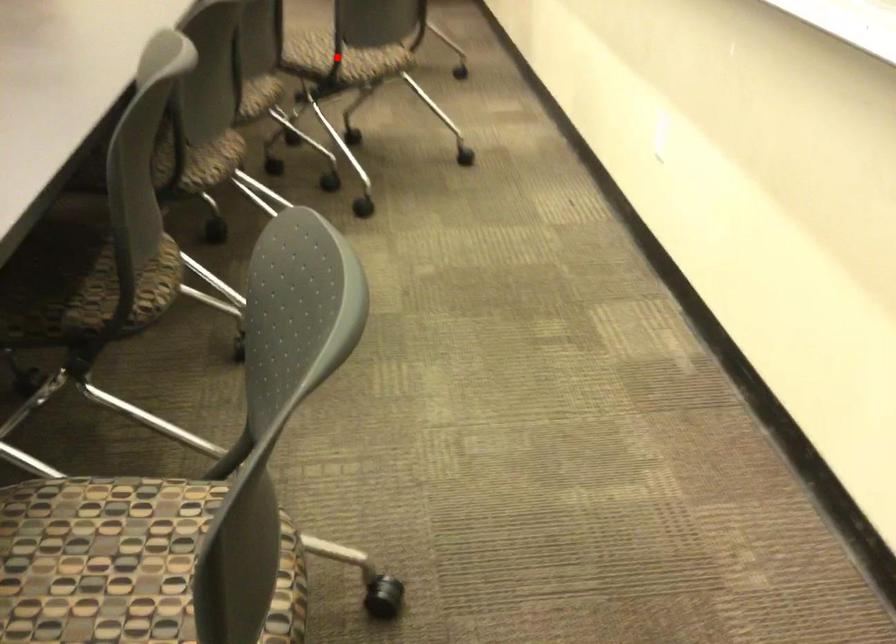
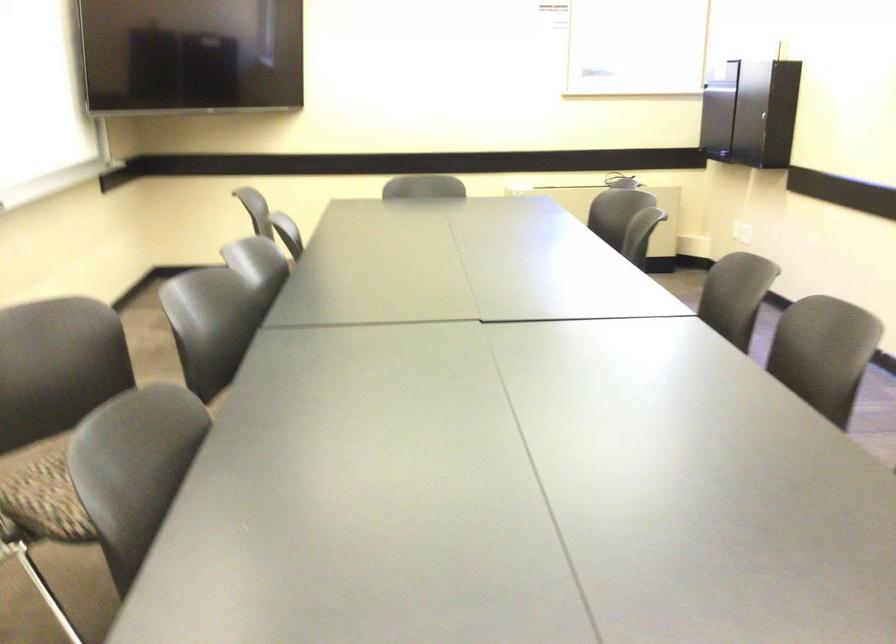
Question: I am providing you with two images of the same scene from different viewpoints. A red point is marked on the first image. Can you still see the location of the red point in image 2?

Choices:
 (A) Yes
 (B) No

Answer: (B)